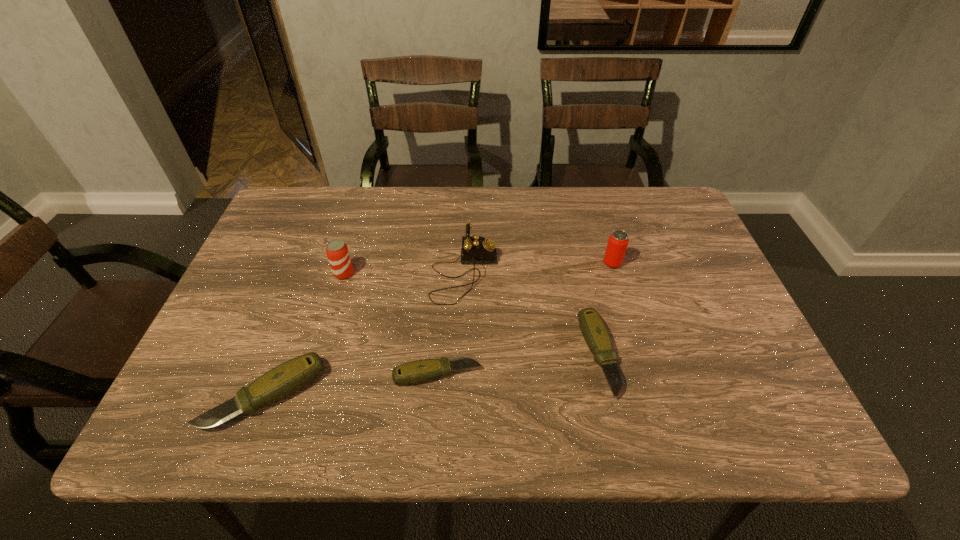
In order to click on blank area located on the right of the second shortest pocketknife in this screenshot , I will do `click(755, 356)`.

This screenshot has width=960, height=540. In order to click on vacant space situated 0.250m on the left of the right beer can in this screenshot , I will do `click(509, 263)`.

Locate an element on the screen. The height and width of the screenshot is (540, 960). vacant area located on the right of the left beer can is located at coordinates (504, 273).

Where is `free spot located on the dial of the telephone`? The width and height of the screenshot is (960, 540). free spot located on the dial of the telephone is located at coordinates (586, 274).

Where is `object positioned at the left edge`? The width and height of the screenshot is (960, 540). object positioned at the left edge is located at coordinates (291, 376).

Identify the location of object present at the near left corner. click(x=291, y=376).

The height and width of the screenshot is (540, 960). I want to click on blank space at the far edge of the desktop, so click(621, 192).

Identify the location of free region at the near edge of the desktop. (326, 392).

In the image, there is a desktop. Identify the location of free space at the left edge. The width and height of the screenshot is (960, 540). (260, 265).

Locate an element on the screen. The width and height of the screenshot is (960, 540). vacant space at the right edge is located at coordinates (682, 302).